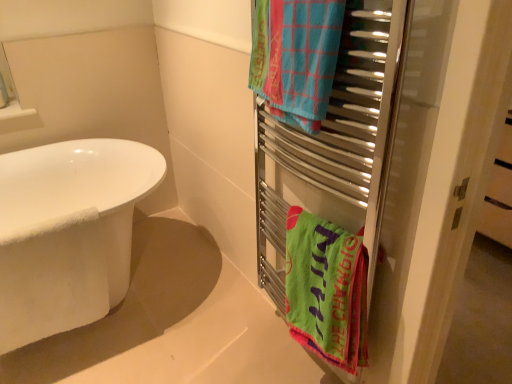
Question: Looking at their shapes, would you say metal towel rack at right is wider or thinner than blue woven towel at upper right, the 2th towel/napkin positioned from the bottom?

Choices:
 (A) thin
 (B) wide

Answer: (B)

Question: Is point (360, 211) positioned closer to the camera than point (310, 102)?

Choices:
 (A) farther
 (B) closer

Answer: (A)

Question: Which object is the closest to the metal towel rack at right?

Choices:
 (A) white matte bathtub at lower left
 (B) blue woven towel at upper right, which appears as the 1th towel/napkin when viewed from the top
 (C) green fabric towel at right, the 2th towel/napkin in the top-to-bottom sequence
 (D) white glossy bathtub at left

Answer: (C)

Question: Which object is the closest to the white matte bathtub at lower left?

Choices:
 (A) metal towel rack at right
 (B) blue woven towel at upper right, which appears as the 1th towel/napkin when viewed from the top
 (C) white glossy bathtub at left
 (D) green fabric towel at right, arranged as the first towel/napkin when ordered from the bottom

Answer: (C)